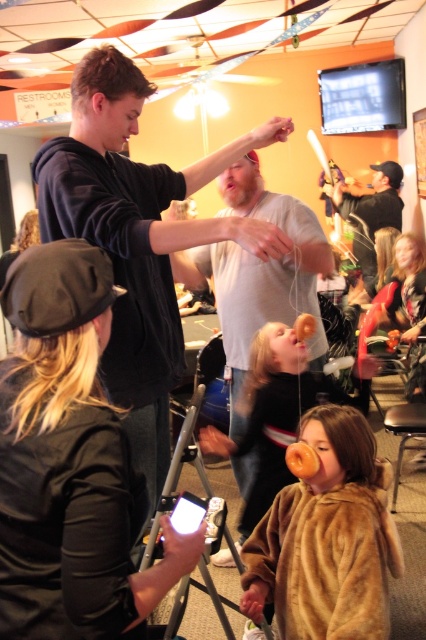
Does black matte hoodie at upper left have a lesser height compared to matte black shirt at center?

In fact, black matte hoodie at upper left may be taller than matte black shirt at center.

Which is behind, point (155, 188) or point (345, 200)?

Point (345, 200)

The height and width of the screenshot is (640, 426). I want to click on black matte hoodie at upper left, so click(138, 237).

Between brown furry coat at center and matte black shirt at center, which one has more height?

matte black shirt at center

Does brown furry coat at center lie in front of matte black shirt at center?

Yes, brown furry coat at center is in front of matte black shirt at center.

This screenshot has width=426, height=640. Find the location of `brown furry coat at center`. brown furry coat at center is located at coordinates [x=271, y=413].

The height and width of the screenshot is (640, 426). I want to click on brown furry coat at center, so click(271, 413).

Who is lower down, black matte hoodie at upper left or brown furry coat at lower center?

brown furry coat at lower center

Is point (158, 214) farther from camera compared to point (308, 486)?

Yes, it is behind point (308, 486).

At what (x,y) coordinates should I click in order to perform the action: click on black matte hoodie at upper left. Please return your answer as a coordinate pair (x, y). Looking at the image, I should click on (138, 237).